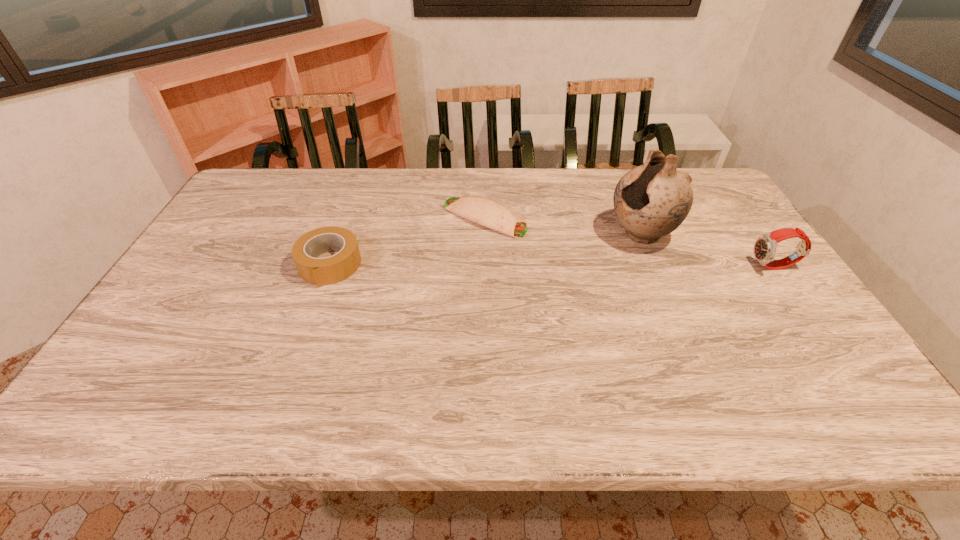
At what (x,y) coordinates should I click in order to perform the action: click on vacant space positioned on the face of the watch. Please return your answer as a coordinate pair (x, y). Image resolution: width=960 pixels, height=540 pixels. Looking at the image, I should click on (609, 267).

Find the location of a particular element. The height and width of the screenshot is (540, 960). free location located 0.170m on the face of the watch is located at coordinates (691, 267).

Where is `vacant point located 0.320m at the bitten end of the shortest object`? vacant point located 0.320m at the bitten end of the shortest object is located at coordinates (619, 269).

Find the location of a particular element. free space located 0.310m at the bitten end of the shortest object is located at coordinates (616, 268).

You are a GUI agent. You are given a task and a screenshot of the screen. Output one action in this format:
    pyautogui.click(x=<x>, y=<y>)
    Task: Click on the free space located at the bitten end of the shortest object
    The width and height of the screenshot is (960, 540).
    Given the screenshot: What is the action you would take?
    pyautogui.click(x=583, y=255)

Identify the location of free space located from the spout of the pottery. (517, 286).

You are a GUI agent. You are given a task and a screenshot of the screen. Output one action in this format:
    pyautogui.click(x=<x>, y=<y>)
    Task: Click on the free space located from the spout of the pottery
    This screenshot has width=960, height=540.
    Given the screenshot: What is the action you would take?
    pyautogui.click(x=517, y=286)

Identify the location of free point located from the spout of the pottery. (602, 251).

Find the location of a particular element. Image resolution: width=960 pixels, height=540 pixels. object present at the far edge is located at coordinates (484, 211).

Identify the location of object at the right edge. This screenshot has width=960, height=540. click(765, 246).